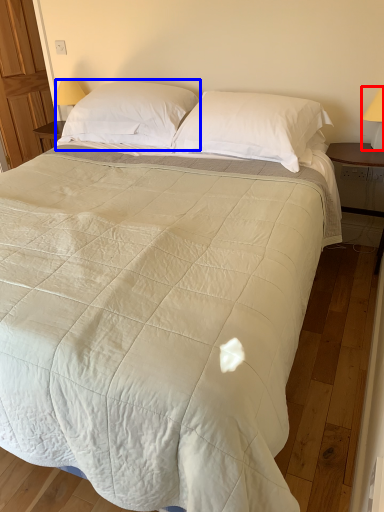
Question: Among these objects, which one is nearest to the camera, table lamp (highlighted by a red box) or pillow (highlighted by a blue box)?

Choices:
 (A) table lamp
 (B) pillow

Answer: (A)